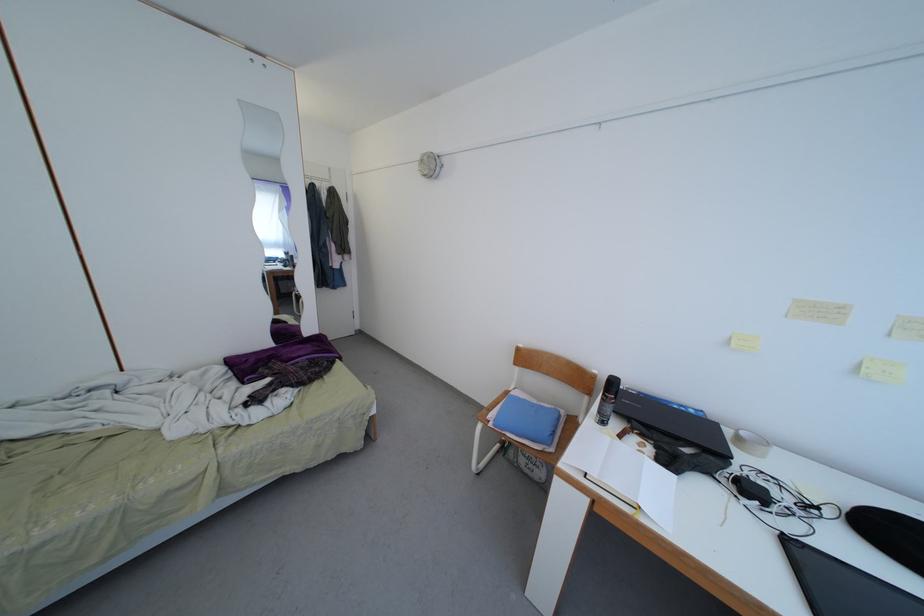
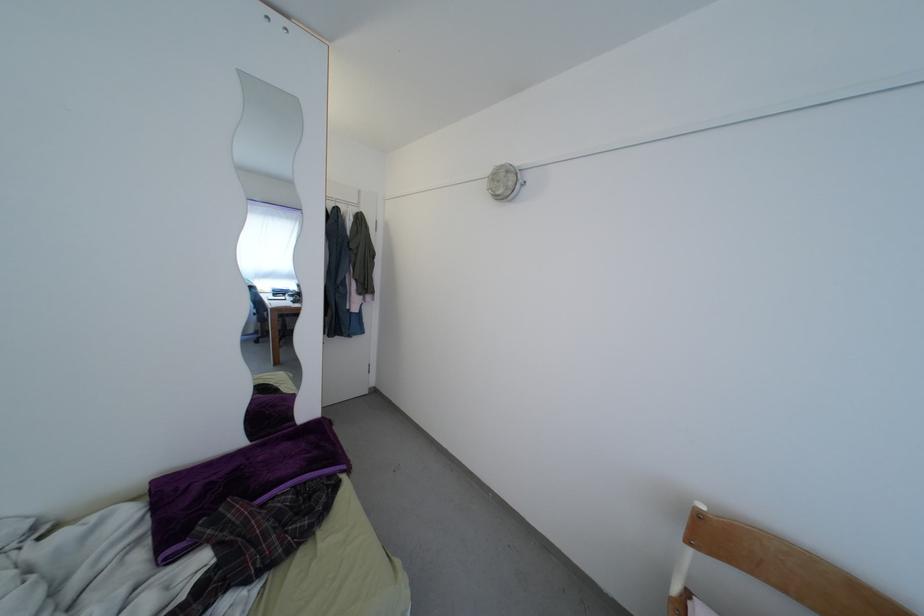
Question: Based on the continuous images, in which direction is the camera rotating? Reply with the corresponding letter.

Choices:
 (A) Left
 (B) Right
 (C) Up
 (D) Down

Answer: (C)